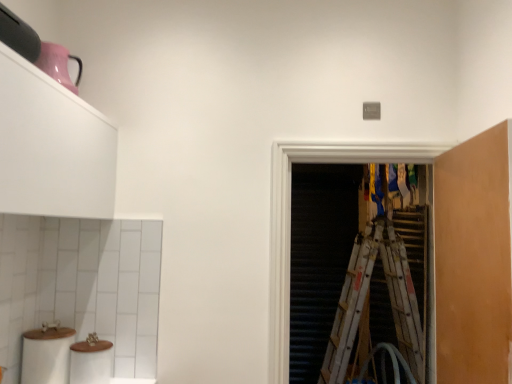
Question: Is white matte cabinet at upper left, arranged as the 2th cabinetry when viewed from the right, inside the boundaries of white matte toilet paper at lower left, or outside?

Choices:
 (A) outside
 (B) inside

Answer: (A)

Question: Is point (64, 175) closer or farther from the camera than point (57, 345)?

Choices:
 (A) closer
 (B) farther

Answer: (A)

Question: Considering the real-world distances, which object is farthest from the white matte cabinet at upper left, which is the first cabinetry in left-to-right order?

Choices:
 (A) white matte toilet paper at lower left
 (B) transparent plastic screen door at center
 (C) matte orange cabinet at right, which is the second cabinetry from left to right
 (D) wooden ladder at right

Answer: (D)

Question: Based on their relative distances, which object is nearer to the white matte toilet paper at lower left?

Choices:
 (A) wooden ladder at right
 (B) matte orange cabinet at right, which is the second cabinetry from left to right
 (C) white matte cabinet at upper left, which is the first cabinetry in left-to-right order
 (D) transparent plastic screen door at center

Answer: (C)